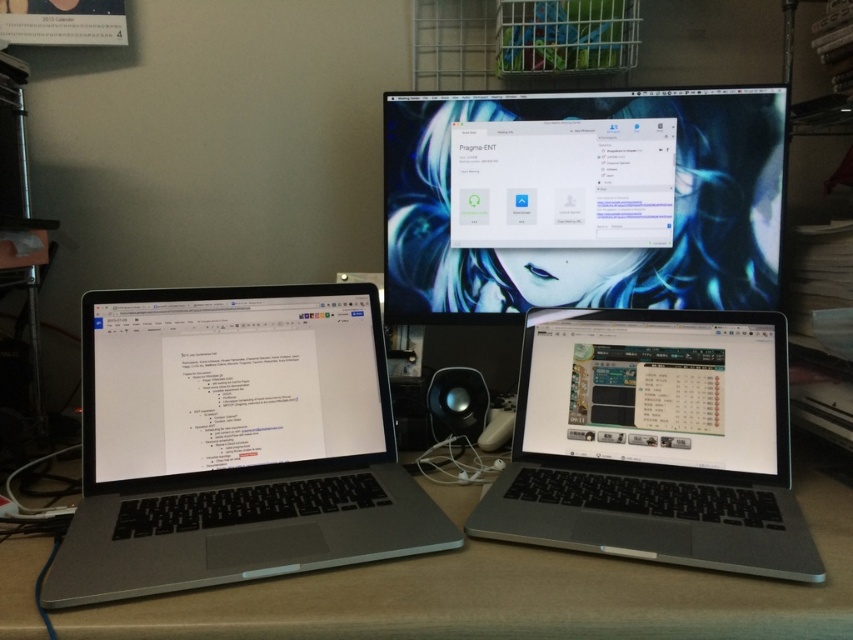
Question: Among these objects, which one is farthest from the camera?

Choices:
 (A) white glossy laptop at left
 (B) matte black monitor at center

Answer: (B)

Question: Based on their relative distances, which object is farther from the sleek silver laptop at lower right?

Choices:
 (A) slate gray laptop at left
 (B) black matte speaker at center
 (C) satin silver laptop at lower center
 (D) matte black laptop at lower right

Answer: (B)

Question: Does matte black monitor at center have a greater width compared to sleek silver laptop at lower right?

Choices:
 (A) yes
 (B) no

Answer: (A)

Question: Can you confirm if slate gray laptop at left is positioned above satin silver laptop at lower center?

Choices:
 (A) no
 (B) yes

Answer: (B)

Question: Is slate gray laptop at left positioned before matte black laptop at lower right?

Choices:
 (A) yes
 (B) no

Answer: (A)

Question: Estimate the real-world distances between objects in this image. Which object is farther from the matte black laptop at lower right?

Choices:
 (A) matte black monitor at center
 (B) sleek silver laptop at lower right

Answer: (A)